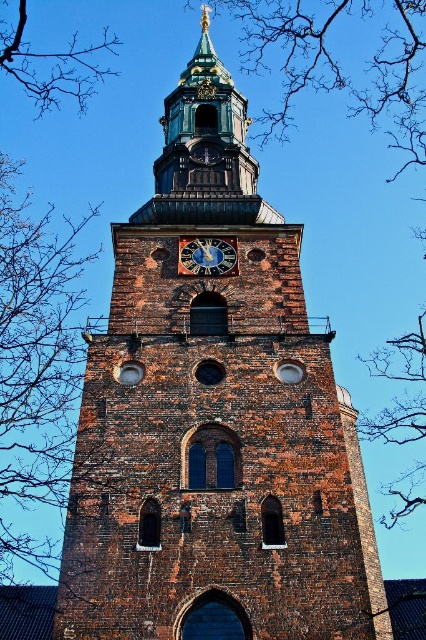
Consider the image. You are standing in front of the historic brick tower and notice two sets of bare branches in the image. Which set of bare branches, the bare branches at left or the bare branches at upper left, is positioned more to the left side of the tower?

The bare branches at left is positioned more to the left side of the tower than the bare branches at upper left.

You are a window cleaner standing at the base of the historic brick tower. You need to clean both the bare branches at left and the blue painted metal clock at center. Which object will require you to climb higher to reach?

The bare branches at left are much taller than the blue painted metal clock at center, so you will need to climb higher to reach the bare branches at left.